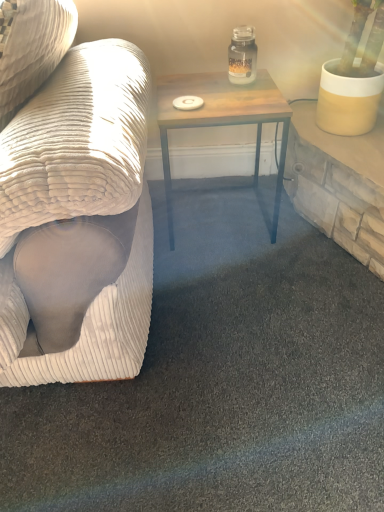
The height and width of the screenshot is (512, 384). Identify the location of wooden table at center. (223, 113).

Where is `table in front of the clear glass jar at upper center`? The image size is (384, 512). table in front of the clear glass jar at upper center is located at coordinates (223, 113).

Is wooden table at center directly adjacent to clear glass jar at upper center?

wooden table at center and clear glass jar at upper center are clearly separated.

Could you tell me if wooden table at center is facing clear glass jar at upper center?

No, wooden table at center is not facing towards clear glass jar at upper center.

Is the depth of wooden table at center greater than that of clear glass jar at upper center?

That is False.

Is wooden table at center facing towards white corduroy couch at left?

No, wooden table at center is not aimed at white corduroy couch at left.

Can you confirm if wooden table at center is thinner than white corduroy couch at left?

Yes, wooden table at center is thinner than white corduroy couch at left.

Does point (173, 97) appear closer or farther from the camera than point (93, 265)?

Point (173, 97) is farther from the camera than point (93, 265).

From the image's perspective, who appears lower, wooden table at center or white corduroy couch at left?

wooden table at center, from the image's perspective.

Is white corduroy couch at left facing away from wooden table at center?

Yes, white corduroy couch at left's orientation is away from wooden table at center.

From a real-world perspective, which object stands above the other?

In real-world perspective, white corduroy couch at left is above.

From the image's perspective, who appears lower, white corduroy couch at left or wooden table at center?

wooden table at center appears lower in the image.

Considering the relative positions of white corduroy couch at left and wooden table at center in the image provided, is white corduroy couch at left to the left of wooden table at center from the viewer's perspective?

Correct, you'll find white corduroy couch at left to the left of wooden table at center.

In the scene shown: Considering the relative positions of clear glass jar at upper center and white corduroy couch at left in the image provided, is clear glass jar at upper center to the right of white corduroy couch at left from the viewer's perspective?

Yes, clear glass jar at upper center is to the right of white corduroy couch at left.

Is clear glass jar at upper center facing towards white corduroy couch at left?

No, clear glass jar at upper center does not turn towards white corduroy couch at left.

What's the angular difference between clear glass jar at upper center and white corduroy couch at left's facing directions?

87.7 degrees separate the facing orientations of clear glass jar at upper center and white corduroy couch at left.

Looking at this image, which object is wider, clear glass jar at upper center or white corduroy couch at left?

white corduroy couch at left.

From the image's perspective, which is above, white corduroy couch at left or clear glass jar at upper center?

From the image's view, clear glass jar at upper center is above.

Is white corduroy couch at left to the left of clear glass jar at upper center from the viewer's perspective?

Yes.

Is white corduroy couch at left located outside clear glass jar at upper center?

Yes, white corduroy couch at left is not within clear glass jar at upper center.

Is clear glass jar at upper center aimed at wooden table at center?

No, clear glass jar at upper center is not facing towards wooden table at center.

Considering the positions of point (247, 31) and point (171, 103), is point (247, 31) closer or farther from the camera than point (171, 103)?

Point (247, 31) is positioned farther from the camera compared to point (171, 103).

Between clear glass jar at upper center and wooden table at center, which one has more height?

Standing taller between the two is wooden table at center.

Can you confirm if clear glass jar at upper center is thinner than wooden table at center?

Indeed, clear glass jar at upper center has a lesser width compared to wooden table at center.

This screenshot has width=384, height=512. Find the location of `table on the left of the clear glass jar at upper center`. table on the left of the clear glass jar at upper center is located at coordinates (223, 113).

Locate an element on the screen. table behind the white corduroy couch at left is located at coordinates (223, 113).

Which object lies nearer to the anchor point white corduroy couch at left, clear glass jar at upper center or wooden table at center?

Among the two, wooden table at center is located nearer to white corduroy couch at left.

Considering their positions, is clear glass jar at upper center positioned further to wooden table at center than white corduroy couch at left?

white corduroy couch at left is positioned further to the anchor wooden table at center.

Based on their spatial positions, is wooden table at center or clear glass jar at upper center closer to white corduroy couch at left?

The object closer to white corduroy couch at left is wooden table at center.

Based on their spatial positions, is wooden table at center or white corduroy couch at left further from clear glass jar at upper center?

The object further to clear glass jar at upper center is white corduroy couch at left.

Estimate the real-world distances between objects in this image. Which object is further from wooden table at center, white corduroy couch at left or clear glass jar at upper center?

white corduroy couch at left is further to wooden table at center.

When comparing their distances from clear glass jar at upper center, does white corduroy couch at left or wooden table at center seem further?

white corduroy couch at left.

Locate an element on the screen. This screenshot has height=512, width=384. table between white corduroy couch at left and clear glass jar at upper center is located at coordinates (223, 113).